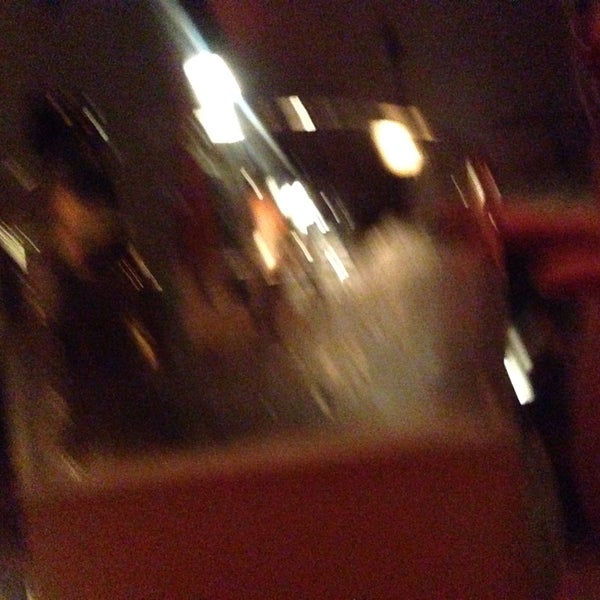
Image resolution: width=600 pixels, height=600 pixels. I want to click on oblong shaped light, so click(x=405, y=159).